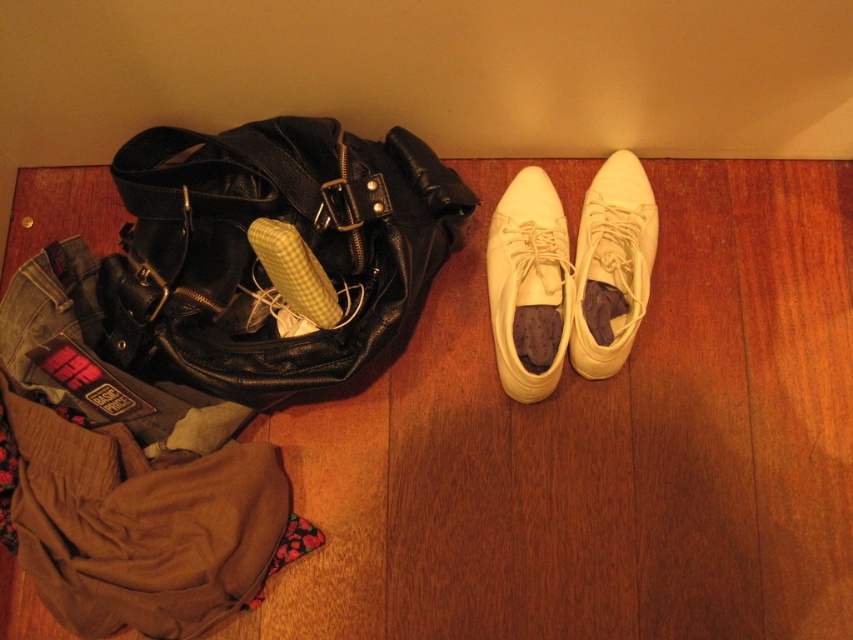
Question: Which point appears closest to the camera in this image?

Choices:
 (A) (532, 292)
 (B) (643, 285)

Answer: (B)

Question: Is black leather bag at left positioned at the back of white leather running shoe at center right?

Choices:
 (A) yes
 (B) no

Answer: (B)

Question: Is the position of black leather bag at left less distant than that of white leather running shoe at center right?

Choices:
 (A) yes
 (B) no

Answer: (A)

Question: Which is farther from the white leather shoe at center?

Choices:
 (A) black leather bag at left
 (B) white leather running shoe at center right

Answer: (A)

Question: In this image, where is black leather bag at left located relative to white leather running shoe at center right?

Choices:
 (A) left
 (B) right

Answer: (A)

Question: Which point appears farthest from the camera in this image?

Choices:
 (A) (215, 225)
 (B) (506, 218)

Answer: (B)